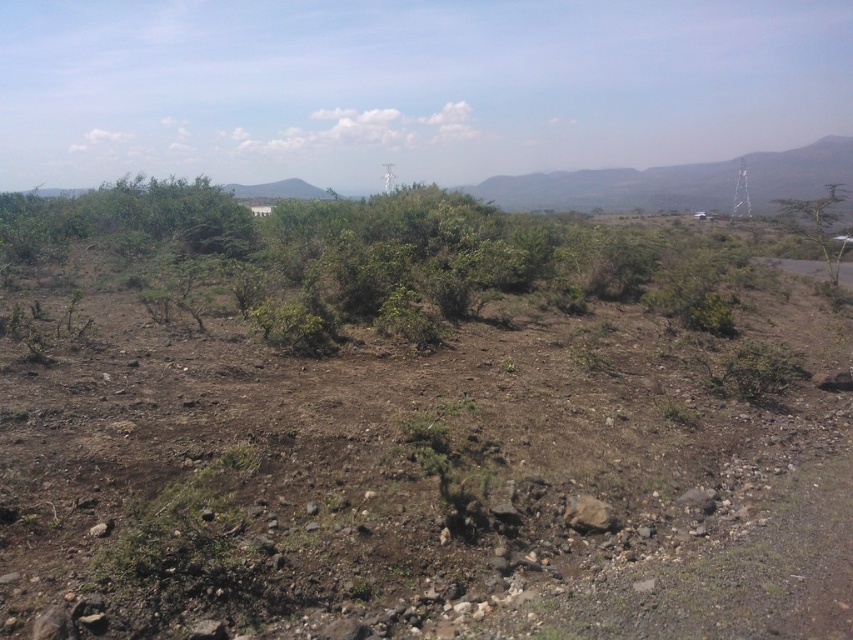
Question: Among these points, which one is nearest to the camera?

Choices:
 (A) (224, 528)
 (B) (822, 248)

Answer: (A)

Question: Is dull brown dirt at center above green leafy tree at right?

Choices:
 (A) no
 (B) yes

Answer: (A)

Question: Can you confirm if dull brown dirt at center is positioned below green leafy tree at right?

Choices:
 (A) no
 (B) yes

Answer: (B)

Question: Which object appears closest to the camera in this image?

Choices:
 (A) green leafy tree at right
 (B) dull brown dirt at center

Answer: (B)

Question: Does dull brown dirt at center appear on the right side of green leafy tree at right?

Choices:
 (A) no
 (B) yes

Answer: (A)